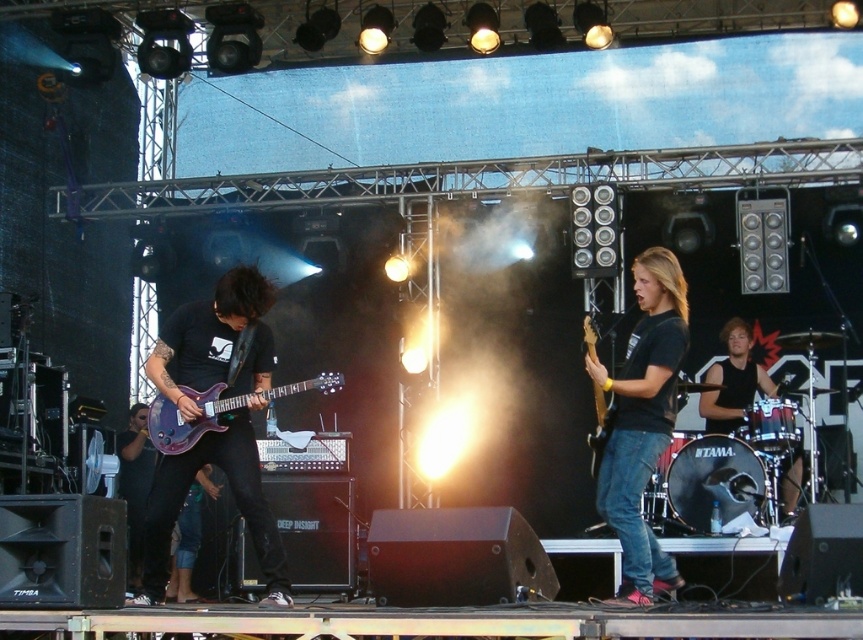
Does black sleeveless shirt at center appear on the right side of purple glossy electric guitar at left?

Yes, black sleeveless shirt at center is to the right of purple glossy electric guitar at left.

Locate an element on the screen. The width and height of the screenshot is (863, 640). black sleeveless shirt at center is located at coordinates (734, 380).

From the picture: Does matte black guitar at left have a larger size compared to brown wood guitar at center-right?

Yes, matte black guitar at left is bigger than brown wood guitar at center-right.

At what (x,y) coordinates should I click in order to perform the action: click on matte black guitar at left. Please return your answer as a coordinate pair (x, y). Looking at the image, I should click on (213, 432).

Who is more distant from viewer, (x=263, y=508) or (x=596, y=385)?

Positioned behind is point (x=263, y=508).

This screenshot has width=863, height=640. In order to click on matte black guitar at left in this screenshot , I will do `click(213, 432)`.

Describe the element at coordinates (641, 420) in the screenshot. This screenshot has height=640, width=863. I see `black matte shirt at center` at that location.

Is black matte shirt at center smaller than brown wood guitar at center-right?

Actually, black matte shirt at center might be larger than brown wood guitar at center-right.

What do you see at coordinates (641, 420) in the screenshot? I see `black matte shirt at center` at bounding box center [641, 420].

This screenshot has width=863, height=640. In order to click on black matte shirt at center in this screenshot , I will do `click(641, 420)`.